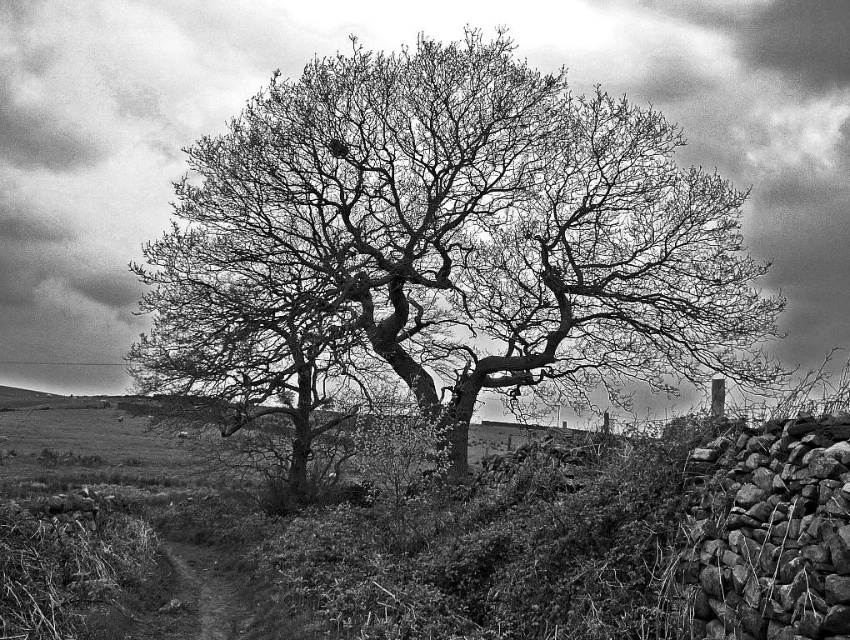
Question: Which of the following is the farthest from the observer?

Choices:
 (A) grassy hillside at center
 (B) bare branches at center

Answer: (B)

Question: Does bare branches at center have a larger size compared to grassy hillside at center?

Choices:
 (A) yes
 (B) no

Answer: (B)

Question: Is bare branches at center smaller than grassy hillside at center?

Choices:
 (A) no
 (B) yes

Answer: (B)

Question: Is bare branches at center above grassy hillside at center?

Choices:
 (A) yes
 (B) no

Answer: (A)